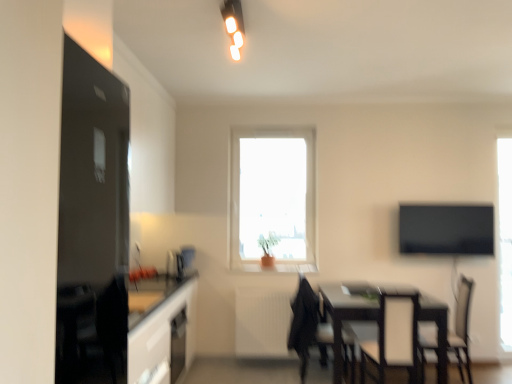
Question: Is point (453, 221) positioned closer to the camera than point (231, 44)?

Choices:
 (A) farther
 (B) closer

Answer: (A)

Question: Is black glossy tv at right wider or thinner than white glossy light fixture at upper center?

Choices:
 (A) wide
 (B) thin

Answer: (B)

Question: Estimate the real-world distances between objects in this image. Which object is closer to the black glossy tv at right?

Choices:
 (A) black fabric chair at lower right, the second chair positioned from the left
 (B) transparent glass window at right, which is the first window from right to left
 (C) black glossy fridge at left
 (D) white glossy light fixture at upper center
 (E) transparent glass window at center, which ranks as the 2th window in right-to-left order

Answer: (B)

Question: Which object is the closest to the white fabric armchair at lower right?

Choices:
 (A) black glossy fridge at left
 (B) dark wood table at lower right
 (C) transparent glass window at center, which ranks as the 2th window in right-to-left order
 (D) black fabric chair at lower right, the 1th chair positioned from the right
 (E) transparent glass window at right, the second window positioned from the left

Answer: (B)